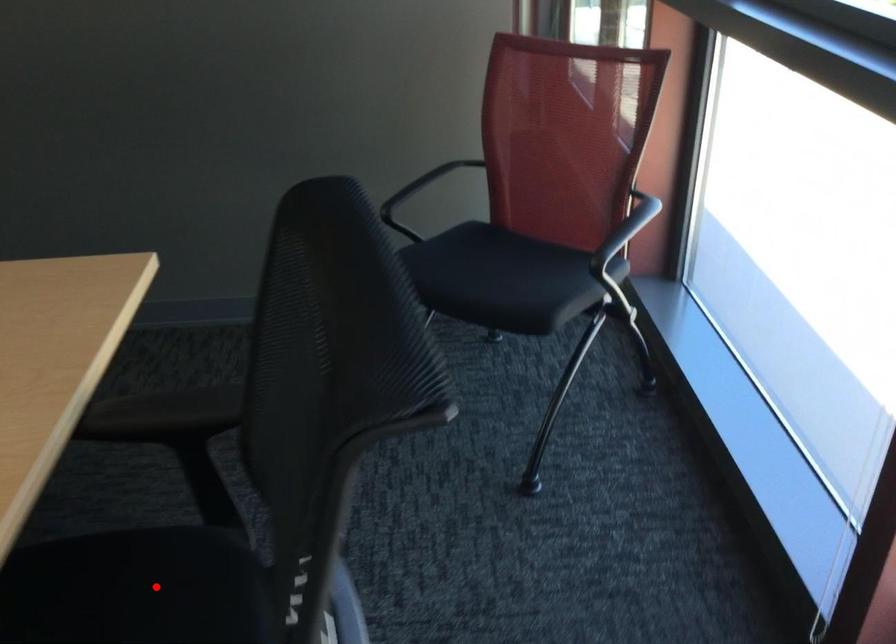
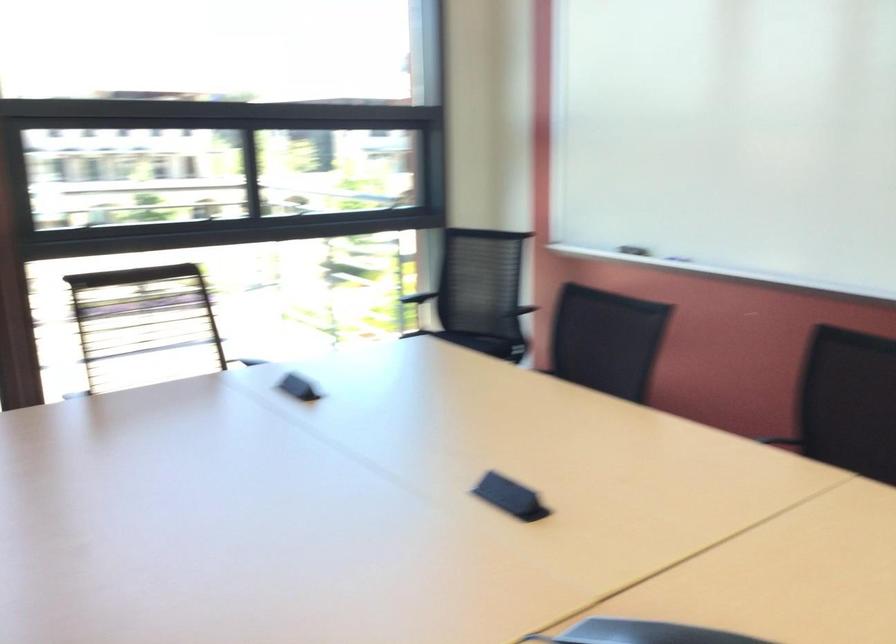
Question: I am providing you with two images of the same scene from different viewpoints. A red point is marked on the first image. Can you still see the location of the red point in image 2?

Choices:
 (A) Yes
 (B) No

Answer: (B)